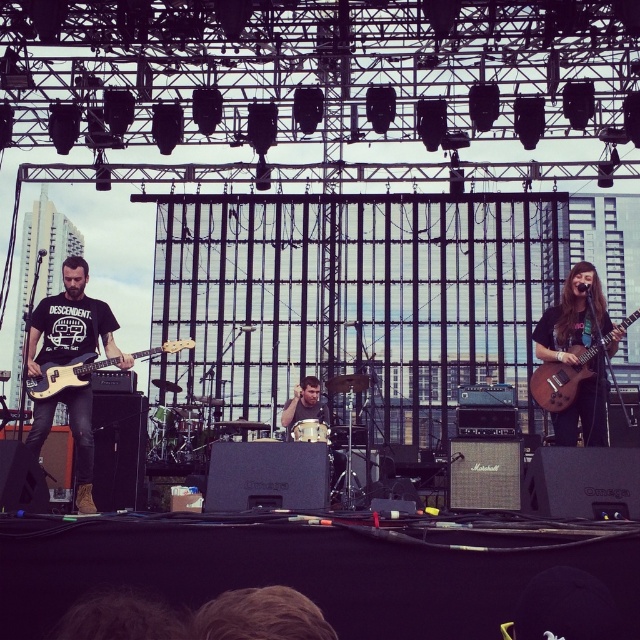
Question: Considering the relative positions of brown wooden guitar at right and smooth drum set at center in the image provided, where is brown wooden guitar at right located with respect to smooth drum set at center?

Choices:
 (A) right
 (B) left

Answer: (A)

Question: Estimate the real-world distances between objects in this image. Which object is closer to the matte black bass guitar at left?

Choices:
 (A) matte black t-shirt at left
 (B) smooth drum set at center
 (C) brown wooden guitar at right

Answer: (A)

Question: Does matte black t-shirt at left lie in front of brown wooden guitar at right?

Choices:
 (A) no
 (B) yes

Answer: (A)

Question: Among these objects, which one is farthest from the camera?

Choices:
 (A) matte black bass guitar at left
 (B) brown wooden guitar at right

Answer: (B)

Question: Is matte black t-shirt at left wider than smooth drum set at center?

Choices:
 (A) yes
 (B) no

Answer: (A)

Question: Which object is closer to the camera taking this photo?

Choices:
 (A) matte black t-shirt at left
 (B) brown wooden guitar at right
 (C) matte black bass guitar at left
 (D) smooth drum set at center

Answer: (C)